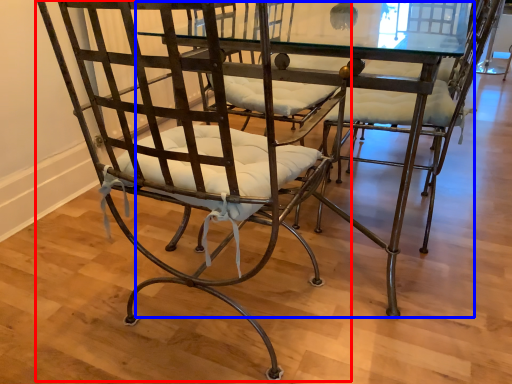
Question: Which of the following is the farthest to the observer, chair (highlighted by a red box) or round table (highlighted by a blue box)?

Choices:
 (A) chair
 (B) round table

Answer: (B)